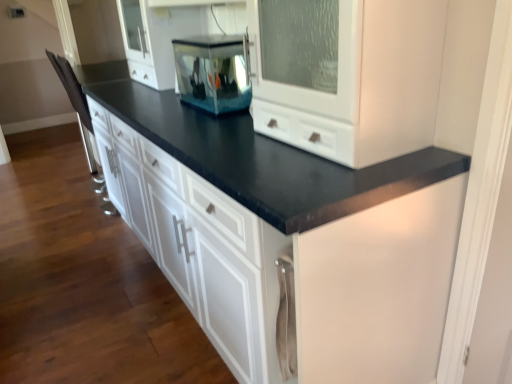
Question: Is transparent glass fish tank at center facing away from matte black countertop at center?

Choices:
 (A) yes
 (B) no

Answer: (A)

Question: Considering the relative sizes of transparent glass fish tank at center and matte black countertop at center in the image provided, is transparent glass fish tank at center bigger than matte black countertop at center?

Choices:
 (A) yes
 (B) no

Answer: (B)

Question: Is transparent glass fish tank at center positioned far away from matte black countertop at center?

Choices:
 (A) yes
 (B) no

Answer: (B)

Question: Can you see transparent glass fish tank at center touching matte black countertop at center?

Choices:
 (A) no
 (B) yes

Answer: (A)

Question: Considering the relative sizes of transparent glass fish tank at center and matte black countertop at center in the image provided, is transparent glass fish tank at center taller than matte black countertop at center?

Choices:
 (A) no
 (B) yes

Answer: (A)

Question: Is transparent glass fish tank at center at the left side of matte black countertop at center?

Choices:
 (A) yes
 (B) no

Answer: (B)

Question: Is the position of matte black countertop at center less distant than that of transparent glass fish tank at center?

Choices:
 (A) yes
 (B) no

Answer: (A)

Question: Does matte black countertop at center come behind transparent glass fish tank at center?

Choices:
 (A) yes
 (B) no

Answer: (B)

Question: Can you confirm if matte black countertop at center is bigger than transparent glass fish tank at center?

Choices:
 (A) yes
 (B) no

Answer: (A)

Question: Can you confirm if matte black countertop at center is thinner than transparent glass fish tank at center?

Choices:
 (A) no
 (B) yes

Answer: (A)

Question: Is matte black countertop at center outside transparent glass fish tank at center?

Choices:
 (A) yes
 (B) no

Answer: (A)

Question: Can you confirm if matte black countertop at center is taller than transparent glass fish tank at center?

Choices:
 (A) yes
 (B) no

Answer: (A)

Question: Considering the relative positions of transparent glass fish tank at center and matte black countertop at center in the image provided, is transparent glass fish tank at center to the left or to the right of matte black countertop at center?

Choices:
 (A) right
 (B) left

Answer: (A)